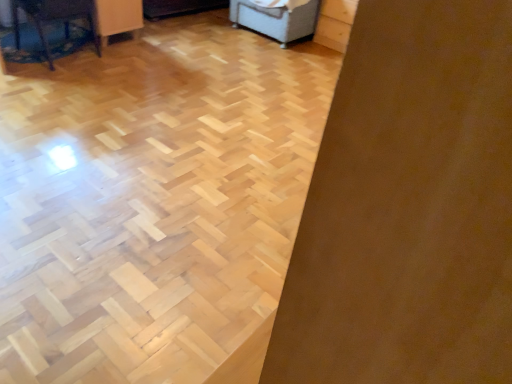
Question: Is the surface of wooden table at left, which appears as the 1th furniture when viewed from the front, in direct contact with light gray fabric ottoman at upper center, acting as the second furniture starting from the front?

Choices:
 (A) yes
 (B) no

Answer: (B)

Question: Does wooden table at left, arranged as the 2th furniture when viewed from the right, appear on the left side of light gray fabric ottoman at upper center, acting as the second furniture starting from the front?

Choices:
 (A) no
 (B) yes

Answer: (B)

Question: Is wooden table at left, which appears as the 1th furniture when viewed from the front, positioned beyond the bounds of light gray fabric ottoman at upper center, placed as the first furniture when sorted from right to left?

Choices:
 (A) yes
 (B) no

Answer: (A)

Question: Is wooden table at left, which appears as the 1th furniture when viewed from the front, smaller than light gray fabric ottoman at upper center, which is the first furniture in back-to-front order?

Choices:
 (A) no
 (B) yes

Answer: (B)

Question: Is wooden table at left, arranged as the 2th furniture when viewed from the right, further to camera compared to light gray fabric ottoman at upper center, which is the 2th furniture from left to right?

Choices:
 (A) no
 (B) yes

Answer: (A)

Question: Is wooden table at left, which appears as the 1th furniture when viewed from the front, oriented towards light gray fabric ottoman at upper center, which is the 2th furniture from left to right?

Choices:
 (A) yes
 (B) no

Answer: (B)

Question: Is light gray fabric ottoman at upper center, which is the first furniture in back-to-front order, taller than wooden table at left, arranged as the 2th furniture when viewed from the right?

Choices:
 (A) no
 (B) yes

Answer: (A)

Question: Is the surface of light gray fabric ottoman at upper center, acting as the second furniture starting from the front, in direct contact with wooden table at left, positioned as the 1th furniture in left-to-right order?

Choices:
 (A) no
 (B) yes

Answer: (A)

Question: Is there a large distance between light gray fabric ottoman at upper center, acting as the second furniture starting from the front, and wooden table at left, positioned as the 1th furniture in left-to-right order?

Choices:
 (A) no
 (B) yes

Answer: (B)

Question: From a real-world perspective, is light gray fabric ottoman at upper center, acting as the second furniture starting from the front, located beneath wooden table at left, arranged as the second furniture when viewed from the back?

Choices:
 (A) yes
 (B) no

Answer: (A)

Question: Is light gray fabric ottoman at upper center, acting as the second furniture starting from the front, shorter than wooden table at left, arranged as the 2th furniture when viewed from the right?

Choices:
 (A) no
 (B) yes

Answer: (B)

Question: From the image's perspective, would you say light gray fabric ottoman at upper center, acting as the second furniture starting from the front, is positioned over wooden table at left, arranged as the second furniture when viewed from the back?

Choices:
 (A) no
 (B) yes

Answer: (B)

Question: From a real-world perspective, is wooden table at left, arranged as the 2th furniture when viewed from the right, physically located above or below light gray fabric ottoman at upper center, placed as the first furniture when sorted from right to left?

Choices:
 (A) above
 (B) below

Answer: (A)